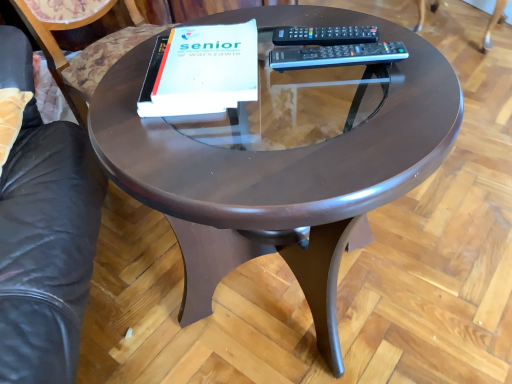
This screenshot has width=512, height=384. I want to click on vacant space to the right of black plastic remote at upper right, the first remote from the back, so click(x=386, y=34).